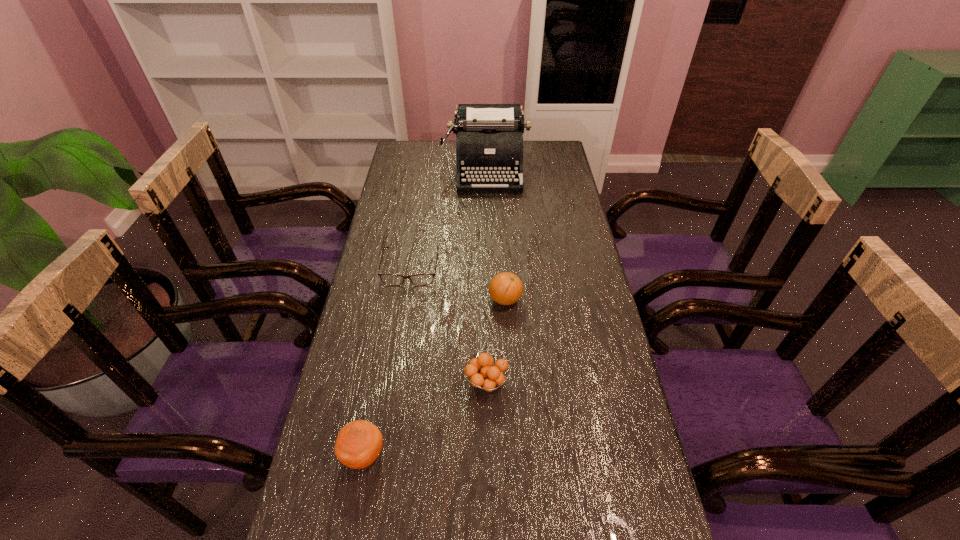
Image resolution: width=960 pixels, height=540 pixels. In the image, there is a desktop. In order to click on vacant region at the right edge in this screenshot , I will do tap(544, 187).

Image resolution: width=960 pixels, height=540 pixels. Identify the location of free space at the far right corner of the desktop. (529, 157).

Locate an element on the screen. The image size is (960, 540). vacant space in between the farthest orange fruit and the shortest object is located at coordinates (458, 284).

Locate an element on the screen. Image resolution: width=960 pixels, height=540 pixels. vacant area that lies between the shortest object and the third nearest object is located at coordinates tap(458, 284).

Locate an element on the screen. This screenshot has height=540, width=960. free space between the tallest object and the third nearest object is located at coordinates (496, 234).

This screenshot has height=540, width=960. I want to click on vacant area between the nearest object and the second farthest orange fruit, so click(425, 418).

The width and height of the screenshot is (960, 540). In order to click on vacant space that is in between the typewriter and the second nearest orange fruit in this screenshot , I will do `click(487, 275)`.

At what (x,y) coordinates should I click in order to perform the action: click on vacant area that lies between the farthest orange fruit and the second farthest orange fruit. Please return your answer as a coordinate pair (x, y). The height and width of the screenshot is (540, 960). Looking at the image, I should click on (496, 341).

Find the location of a particular element. The height and width of the screenshot is (540, 960). vacant region between the leftmost orange fruit and the farthest orange fruit is located at coordinates (435, 377).

Locate an element on the screen. The height and width of the screenshot is (540, 960). free space between the nearest object and the farthest object is located at coordinates (425, 312).